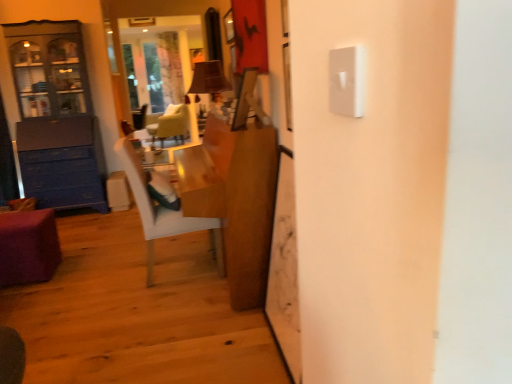
Question: Considering the relative positions of matte blue cabinet at left and white textured curtain at upper center in the image provided, is matte blue cabinet at left to the left of white textured curtain at upper center from the viewer's perspective?

Choices:
 (A) yes
 (B) no

Answer: (A)

Question: Does matte blue cabinet at left turn towards white textured curtain at upper center?

Choices:
 (A) yes
 (B) no

Answer: (B)

Question: From the image's perspective, is matte blue cabinet at left on top of white textured curtain at upper center?

Choices:
 (A) no
 (B) yes

Answer: (A)

Question: Can you confirm if matte blue cabinet at left is wider than white textured curtain at upper center?

Choices:
 (A) no
 (B) yes

Answer: (B)

Question: Is matte blue cabinet at left further to camera compared to white textured curtain at upper center?

Choices:
 (A) yes
 (B) no

Answer: (B)

Question: Does matte blue cabinet at left have a lesser height compared to white textured curtain at upper center?

Choices:
 (A) no
 (B) yes

Answer: (B)

Question: Does white textured curtain at upper center contain wooden desk at center?

Choices:
 (A) no
 (B) yes

Answer: (A)

Question: Is white textured curtain at upper center smaller than wooden desk at center?

Choices:
 (A) no
 (B) yes

Answer: (B)

Question: From the image's perspective, is white textured curtain at upper center under wooden desk at center?

Choices:
 (A) no
 (B) yes

Answer: (A)

Question: From a real-world perspective, is white textured curtain at upper center located beneath wooden desk at center?

Choices:
 (A) no
 (B) yes

Answer: (A)

Question: From a real-world perspective, is white textured curtain at upper center on wooden desk at center?

Choices:
 (A) yes
 (B) no

Answer: (A)

Question: Is wooden desk at center at the back of white textured curtain at upper center?

Choices:
 (A) yes
 (B) no

Answer: (B)

Question: Is wooden desk at center beside white textured curtain at upper center?

Choices:
 (A) yes
 (B) no

Answer: (B)